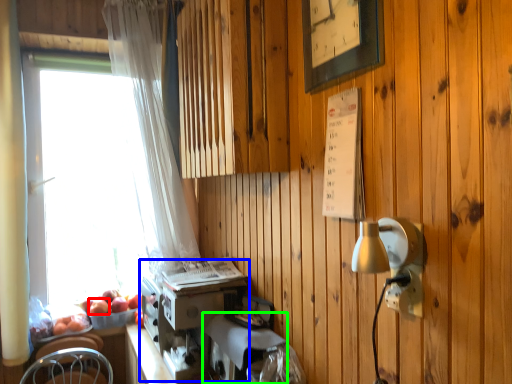
Question: Estimate the real-world distances between objects in this image. Which object is closer to apple (highlighted by a red box), coffee machine (highlighted by a blue box) or appliance (highlighted by a green box)?

Choices:
 (A) coffee machine
 (B) appliance

Answer: (A)